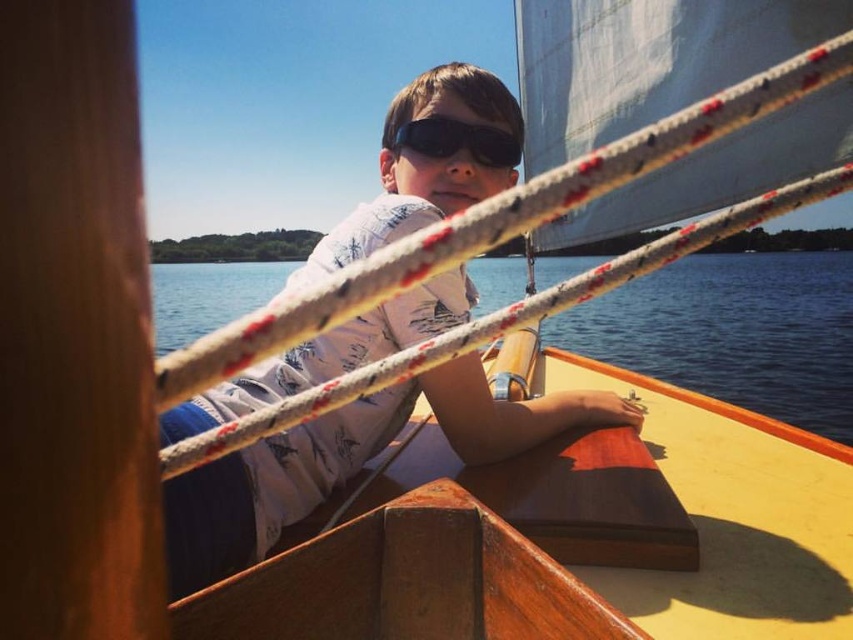
Question: Which point is closer to the camera taking this photo?

Choices:
 (A) (223, 266)
 (B) (428, 129)
 (C) (437, 400)

Answer: (C)

Question: Among these points, which one is farthest from the camera?

Choices:
 (A) (260, 369)
 (B) (460, 141)

Answer: (B)

Question: Is clear blue water at center thinner than black matte goggles at center?

Choices:
 (A) yes
 (B) no

Answer: (B)

Question: Can you confirm if white cotton shirt at center is smaller than clear blue water at center?

Choices:
 (A) yes
 (B) no

Answer: (A)

Question: Which of the following is the farthest from the observer?

Choices:
 (A) black matte goggles at center
 (B) white cotton shirt at center

Answer: (A)

Question: Can you confirm if clear blue water at center is wider than black matte goggles at center?

Choices:
 (A) no
 (B) yes

Answer: (B)